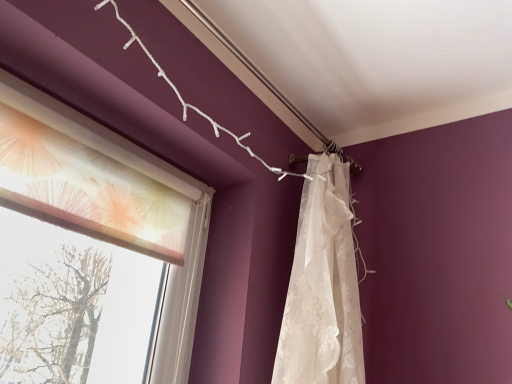
Question: Does translucent fabric at left turn towards white lace curtain at upper right?

Choices:
 (A) yes
 (B) no

Answer: (B)

Question: Is translucent fabric at left to the left of white lace curtain at upper right from the viewer's perspective?

Choices:
 (A) no
 (B) yes

Answer: (B)

Question: Would you say translucent fabric at left is a long distance from white lace curtain at upper right?

Choices:
 (A) yes
 (B) no

Answer: (B)

Question: Is translucent fabric at left closer to the viewer compared to white lace curtain at upper right?

Choices:
 (A) yes
 (B) no

Answer: (A)

Question: From a real-world perspective, is translucent fabric at left on white lace curtain at upper right?

Choices:
 (A) yes
 (B) no

Answer: (A)

Question: From the image's perspective, does translucent fabric at left appear higher than white lace curtain at upper right?

Choices:
 (A) yes
 (B) no

Answer: (A)

Question: Does white lace curtain at upper right come in front of translucent fabric at left?

Choices:
 (A) no
 (B) yes

Answer: (A)

Question: Is white lace curtain at upper right facing towards translucent fabric at left?

Choices:
 (A) yes
 (B) no

Answer: (B)

Question: Considering the relative sizes of white lace curtain at upper right and translucent fabric at left in the image provided, is white lace curtain at upper right shorter than translucent fabric at left?

Choices:
 (A) yes
 (B) no

Answer: (B)

Question: From the image's perspective, is white lace curtain at upper right located beneath translucent fabric at left?

Choices:
 (A) no
 (B) yes

Answer: (B)

Question: From a real-world perspective, is white lace curtain at upper right positioned under translucent fabric at left based on gravity?

Choices:
 (A) yes
 (B) no

Answer: (A)

Question: Is white lace curtain at upper right far from translucent fabric at left?

Choices:
 (A) yes
 (B) no

Answer: (B)

Question: Is white lace curtain at upper right taller or shorter than translucent fabric at left?

Choices:
 (A) tall
 (B) short

Answer: (A)